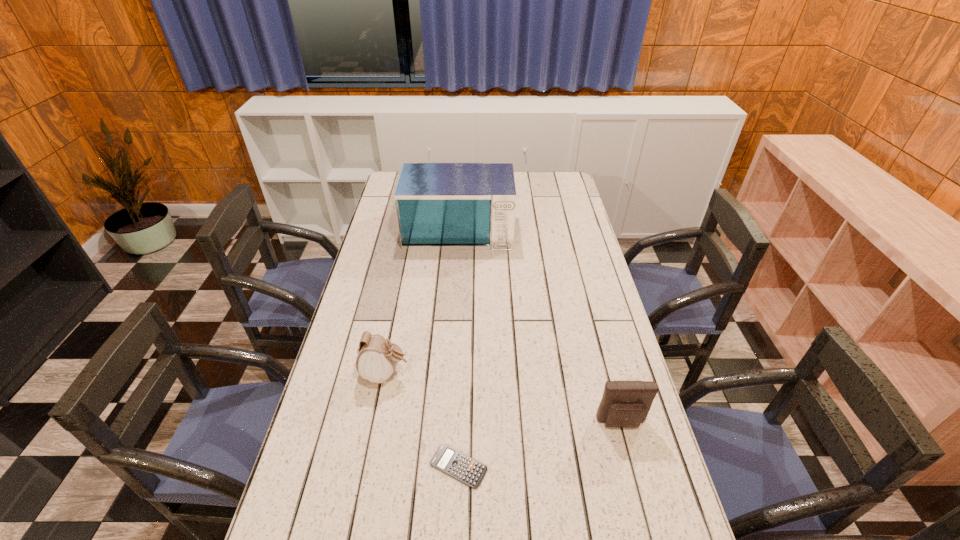
In order to click on microwave oven in this screenshot , I will do `click(440, 206)`.

Image resolution: width=960 pixels, height=540 pixels. Find the location of `the tallest object`. the tallest object is located at coordinates (440, 206).

The image size is (960, 540). Find the location of `the left pouch`. the left pouch is located at coordinates (377, 358).

Where is `the farther pouch`? Image resolution: width=960 pixels, height=540 pixels. the farther pouch is located at coordinates [377, 358].

The image size is (960, 540). I want to click on the right pouch, so click(x=625, y=404).

At what (x,y) coordinates should I click in order to perform the action: click on the second nearest object. Please return your answer as a coordinate pair (x, y). The height and width of the screenshot is (540, 960). Looking at the image, I should click on (625, 404).

Where is `the nearest object`? The width and height of the screenshot is (960, 540). the nearest object is located at coordinates (450, 461).

At what (x,y) coordinates should I click in order to perform the action: click on the shortest object. Please return your answer as a coordinate pair (x, y). This screenshot has height=540, width=960. Looking at the image, I should click on (450, 461).

Where is `vacant space located 0.340m on the front-facing side of the microwave oven`? This screenshot has height=540, width=960. vacant space located 0.340m on the front-facing side of the microwave oven is located at coordinates (453, 310).

Where is `vacant space located 0.090m on the front-facing side of the farther pouch`? The image size is (960, 540). vacant space located 0.090m on the front-facing side of the farther pouch is located at coordinates click(x=441, y=374).